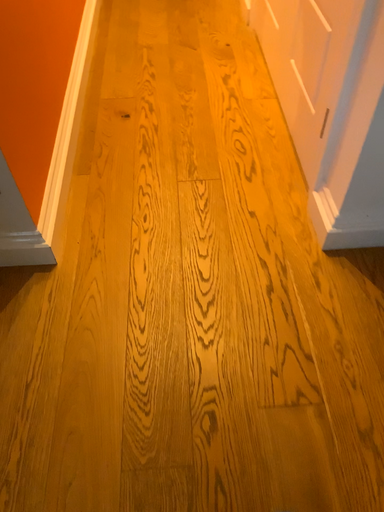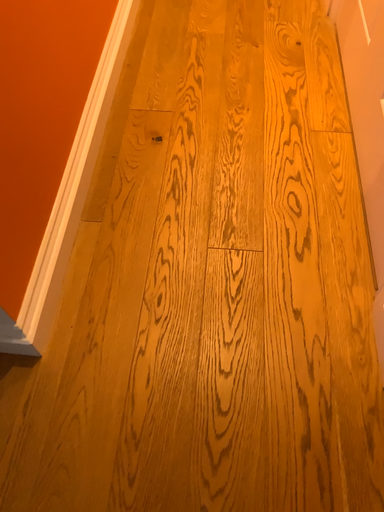
Question: How did the camera likely rotate when shooting the video?

Choices:
 (A) rotated upward
 (B) rotated downward

Answer: (B)